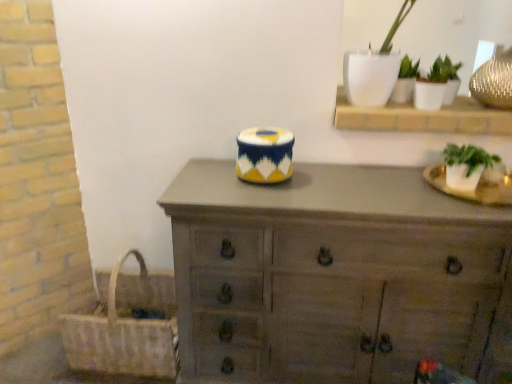
The image size is (512, 384). What are the coordinates of `free space in front of white glossy pot at upper right, the 3th houseplant from the bottom` in the screenshot? It's located at (409, 111).